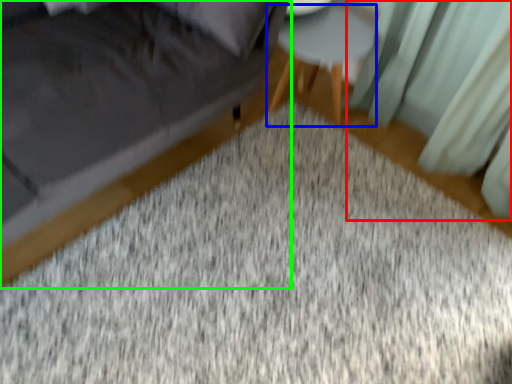
Question: Considering the real-world distances, which object is farthest from curtain (highlighted by a red box)? side table (highlighted by a blue box) or furniture (highlighted by a green box)?

Choices:
 (A) side table
 (B) furniture

Answer: (B)